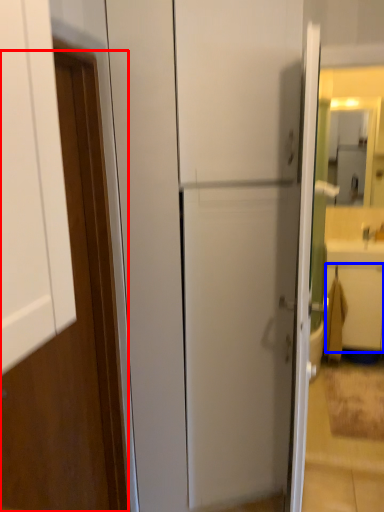
Question: Which point is further to the camera, door (highlighted by a red box) or drawer (highlighted by a blue box)?

Choices:
 (A) door
 (B) drawer

Answer: (B)